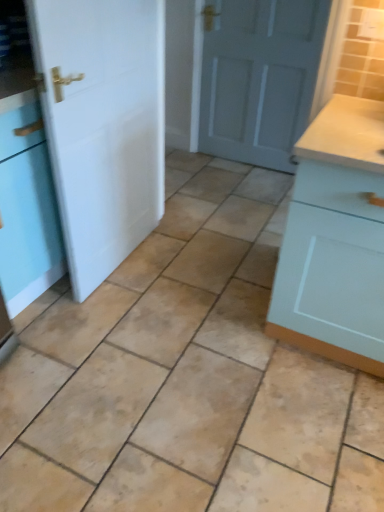
Question: Considering their positions, is beige ceramic tile at center located in front of or behind light blue wood cabinet at right?

Choices:
 (A) front
 (B) behind

Answer: (A)

Question: From a real-world perspective, is beige ceramic tile at center positioned above or below light blue wood cabinet at right?

Choices:
 (A) below
 (B) above

Answer: (A)

Question: Which is farther from the matte gray door at center, which appears as the first door when viewed from the back?

Choices:
 (A) beige ceramic tile at center
 (B) white matte door at left, arranged as the first door when viewed from the left
 (C) light blue wood cabinet at right

Answer: (C)

Question: Estimate the real-world distances between objects in this image. Which object is closer to the beige ceramic tile at center?

Choices:
 (A) matte gray door at center, placed as the 1th door when sorted from right to left
 (B) white matte door at left, which ranks as the second door in right-to-left order
 (C) light blue wood cabinet at right

Answer: (C)